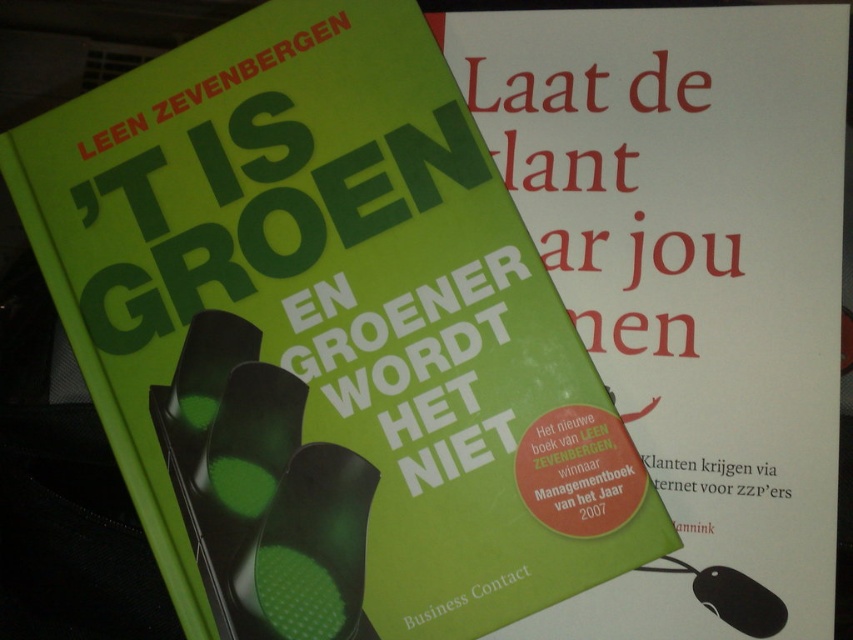
Looking at this image, you are organizing a desk and need to place both the green matte book cover at upper right and the black rubber mouse at lower right. Given their sizes, which object will require more horizontal space on the desk?

The green matte book cover at upper right requires more horizontal space on the desk because its width is larger than the black rubber mouse at lower right.

You are organizing a desk and need to place both the green matte book cover at upper right and the black rubber mouse at lower right. Given their sizes, which object should you place first to ensure they both fit on the desk?

The green matte book cover at upper right is taller than the black rubber mouse at lower right. Since it is taller, you should place the green matte book cover at upper right first to ensure there is enough space for both items on the desk.

You are organizing a desk and need to place both the green matte book cover at upper right and the black rubber mouse at lower right. Given their sizes, which object will require more desk space?

The green matte book cover at upper right requires more desk space because it has a larger size compared to the black rubber mouse at lower right.